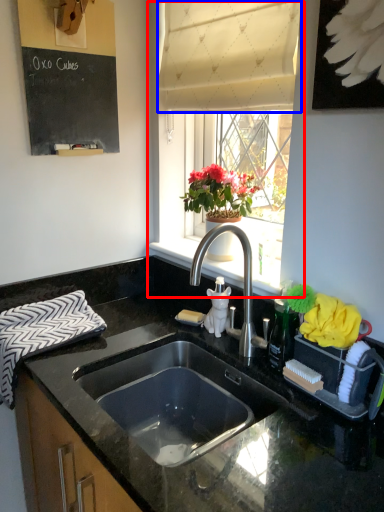
Question: Which of the following is the farthest to the observer, window (highlighted by a red box) or curtain (highlighted by a blue box)?

Choices:
 (A) window
 (B) curtain

Answer: (B)